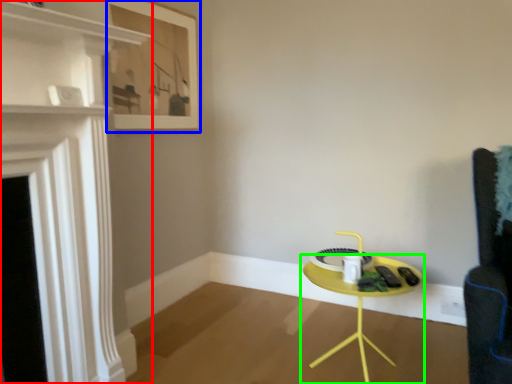
Question: Estimate the real-world distances between objects in this image. Which object is farther from fireplace (highlighted by a red box), picture frame (highlighted by a blue box) or table (highlighted by a green box)?

Choices:
 (A) picture frame
 (B) table

Answer: (B)